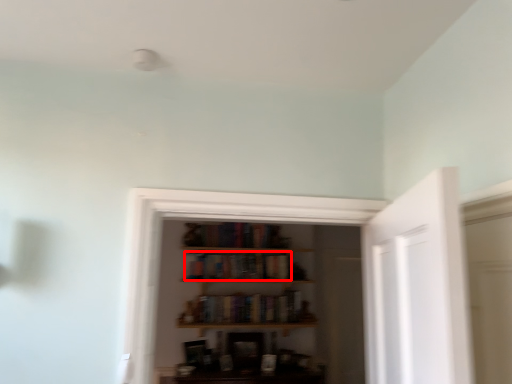
Question: From the image's perspective, where is book (annotated by the red box) located relative to book?

Choices:
 (A) below
 (B) above

Answer: (B)